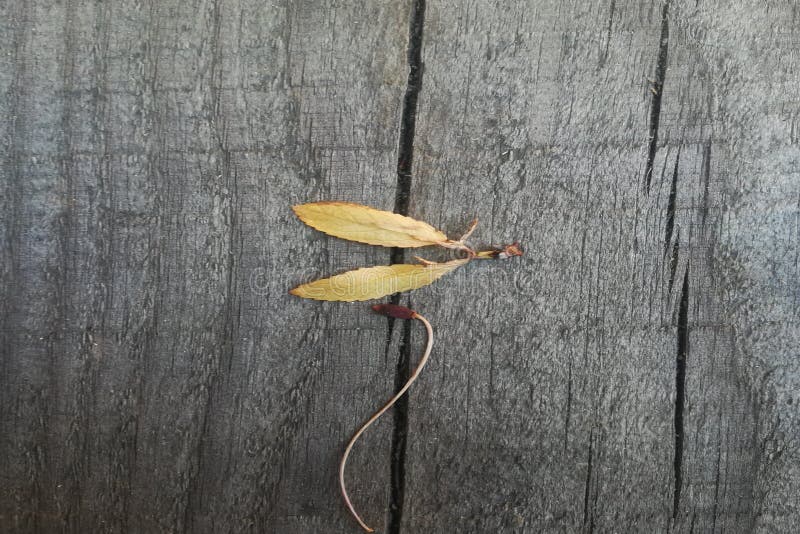
The width and height of the screenshot is (800, 534). In order to click on wooden floorboard in this screenshot , I will do `click(176, 446)`, `click(478, 375)`.